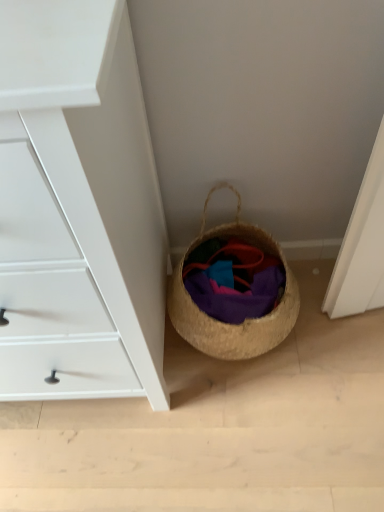
Question: Should I look upward or downward to see purple woven fabric at lower center?

Choices:
 (A) down
 (B) up

Answer: (A)

Question: Does white matte chest of drawers at lower left appear on the right side of woven straw basket at lower right?

Choices:
 (A) no
 (B) yes

Answer: (A)

Question: Is white matte chest of drawers at lower left facing towards woven straw basket at lower right?

Choices:
 (A) yes
 (B) no

Answer: (B)

Question: Considering the relative sizes of white matte chest of drawers at lower left and woven straw basket at lower right in the image provided, is white matte chest of drawers at lower left wider than woven straw basket at lower right?

Choices:
 (A) yes
 (B) no

Answer: (A)

Question: Is white matte chest of drawers at lower left positioned before woven straw basket at lower right?

Choices:
 (A) no
 (B) yes

Answer: (B)

Question: Is white matte chest of drawers at lower left not within woven straw basket at lower right?

Choices:
 (A) yes
 (B) no

Answer: (A)

Question: Is white matte chest of drawers at lower left looking in the opposite direction of woven straw basket at lower right?

Choices:
 (A) no
 (B) yes

Answer: (A)

Question: Is woven straw basket at lower right completely or partially inside purple woven fabric at lower center?

Choices:
 (A) no
 (B) yes

Answer: (A)

Question: Is purple woven fabric at lower center closer to camera compared to woven straw basket at lower right?

Choices:
 (A) yes
 (B) no

Answer: (B)

Question: Does purple woven fabric at lower center appear on the left side of woven straw basket at lower right?

Choices:
 (A) no
 (B) yes

Answer: (A)

Question: Is purple woven fabric at lower center outside woven straw basket at lower right?

Choices:
 (A) no
 (B) yes

Answer: (A)

Question: Is purple woven fabric at lower center with woven straw basket at lower right?

Choices:
 (A) no
 (B) yes

Answer: (B)

Question: Is purple woven fabric at lower center aimed at woven straw basket at lower right?

Choices:
 (A) no
 (B) yes

Answer: (B)

Question: Is woven straw basket at lower right thinner than purple woven fabric at lower center?

Choices:
 (A) yes
 (B) no

Answer: (B)